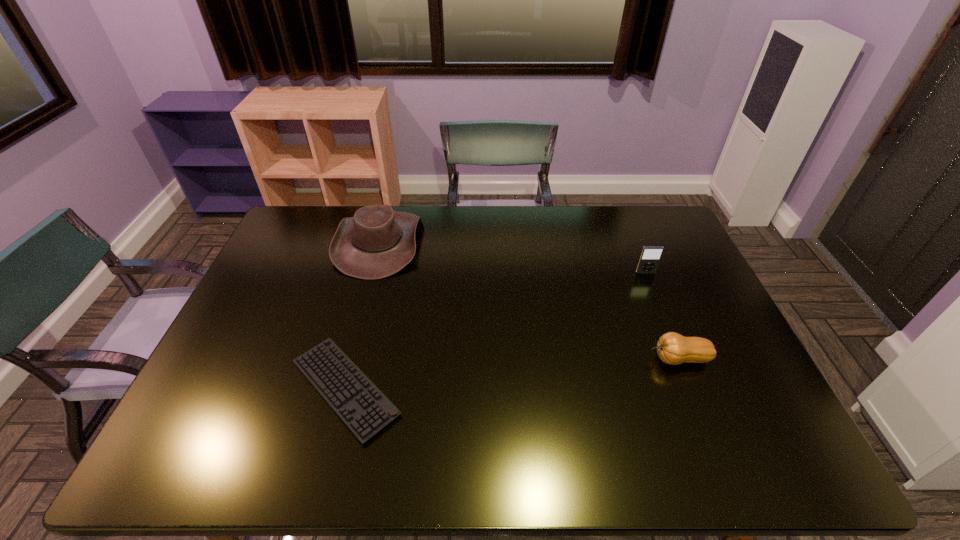
I want to click on free space between the gourd and the cowboy hat, so click(x=529, y=300).

At what (x,y) coordinates should I click in order to perform the action: click on object that is the second closest to the second tallest object. Please return your answer as a coordinate pair (x, y). Looking at the image, I should click on (377, 242).

Choose which object is the second nearest neighbor to the computer keyboard. Please provide its 2D coordinates. Your answer should be formatted as a tuple, i.e. [(x, y)], where the tuple contains the x and y coordinates of a point satisfying the conditions above.

[(672, 348)]

Identify the location of vacant area in the image that satisfies the following two spatial constraints: 1. on the front-facing side of the iPod; 2. on the stem side of the third tallest object. The height and width of the screenshot is (540, 960). (680, 359).